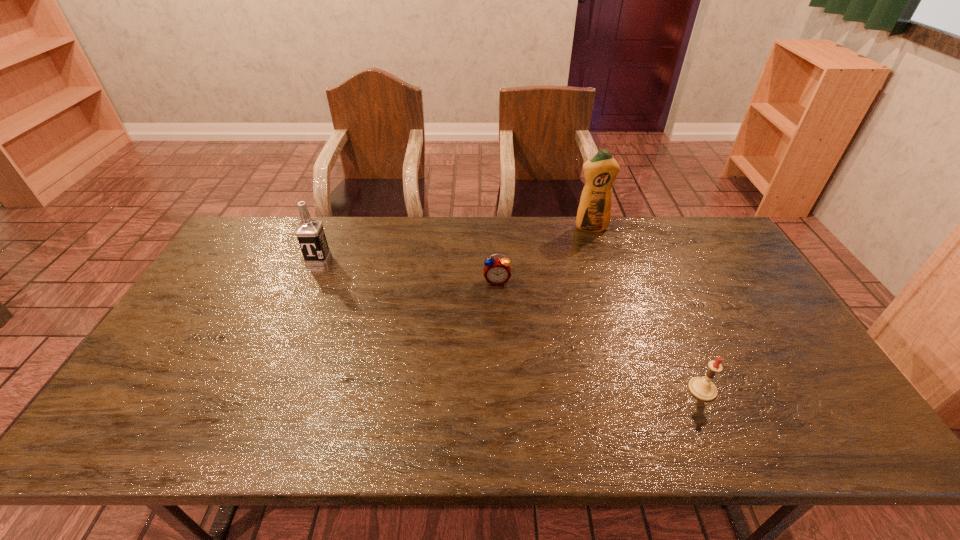
The width and height of the screenshot is (960, 540). In order to click on free space located 0.320m on the back of the candle in this screenshot , I will do `click(659, 289)`.

Locate an element on the screen. The width and height of the screenshot is (960, 540). vacant space located 0.390m on the front-facing side of the alarm clock is located at coordinates (502, 397).

The width and height of the screenshot is (960, 540). What are the coordinates of `detergent that is at the far edge` in the screenshot? It's located at (594, 212).

Image resolution: width=960 pixels, height=540 pixels. What are the coordinates of `vodka that is at the far edge` in the screenshot? It's located at (310, 233).

Locate an element on the screen. The image size is (960, 540). vacant space at the far edge of the desktop is located at coordinates (329, 226).

I want to click on free space at the near edge of the desktop, so click(x=221, y=440).

In the image, there is a desktop. What are the coordinates of `blank space at the left edge` in the screenshot? It's located at (247, 285).

Where is `vacant area between the nearest object and the alarm clock`? The height and width of the screenshot is (540, 960). vacant area between the nearest object and the alarm clock is located at coordinates (600, 335).

Find the location of `vacant space in between the leftmost object and the nearest object`. vacant space in between the leftmost object and the nearest object is located at coordinates (511, 324).

I want to click on vacant space that is in between the candle and the tallest object, so click(646, 308).